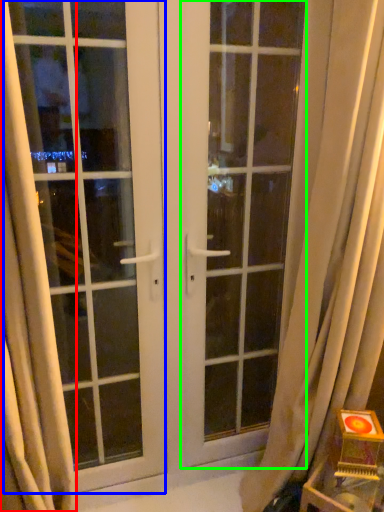
Question: Estimate the real-world distances between objects in this image. Which object is farther from curtain (highlighted by a red box), window (highlighted by a blue box) or screen door (highlighted by a green box)?

Choices:
 (A) window
 (B) screen door

Answer: (B)